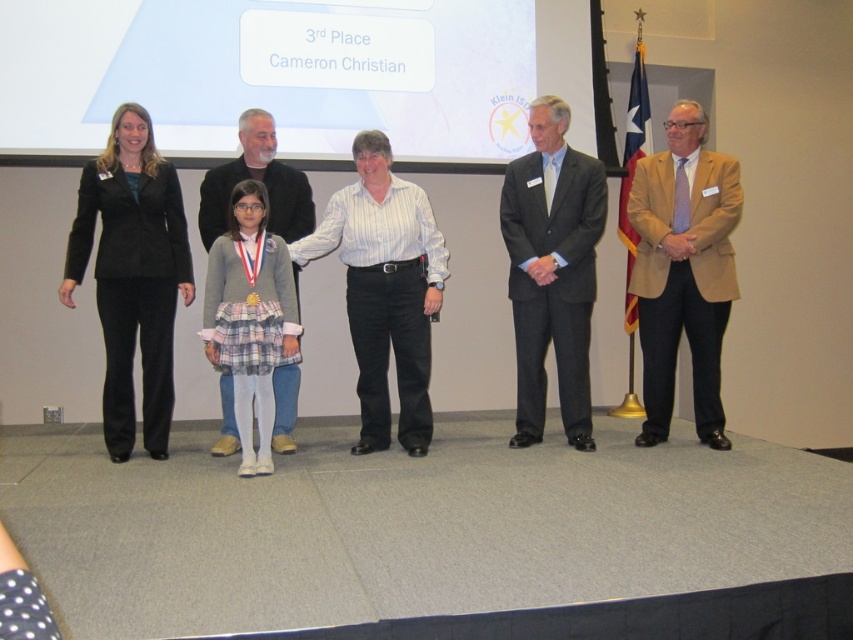
Can you confirm if black suit at left is thinner than dark gray suit at center?

In fact, black suit at left might be wider than dark gray suit at center.

Between black suit at left and dark gray suit at center, which one has less height?

→ black suit at left

Is point (119, 337) farther from viewer compared to point (561, 388)?

No.

Where is `black suit at left`? The height and width of the screenshot is (640, 853). black suit at left is located at coordinates (132, 275).

Which is above, tan fabric suit at right or white striped shirt at center?

Positioned higher is tan fabric suit at right.

At what (x,y) coordinates should I click in order to perform the action: click on tan fabric suit at right. Please return your answer as a coordinate pair (x, y). Looking at the image, I should click on (683, 269).

Which is in front, point (634, 262) or point (355, 202)?

Point (355, 202) is in front.

I want to click on tan fabric suit at right, so coord(683,269).

Between dark gray suit at center and white striped shirt at center, which one has less height?

white striped shirt at center is shorter.

Is dark gray suit at center bigger than white striped shirt at center?

No, dark gray suit at center is not bigger than white striped shirt at center.

Which is in front, point (538, 99) or point (427, 344)?

Point (427, 344) is in front.

Locate an element on the screen. dark gray suit at center is located at coordinates tap(552, 269).